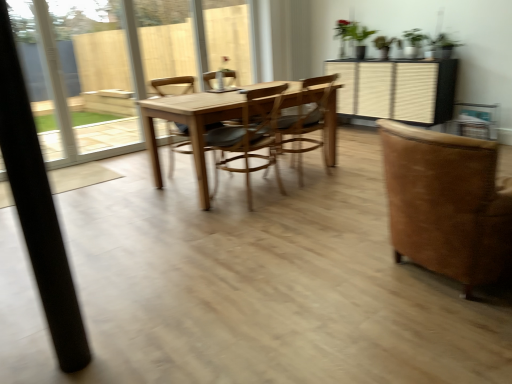
Identify the location of vacant position to the left of brown suede chair at right, which ranks as the first chair in right-to-left order. The image size is (512, 384). (318, 278).